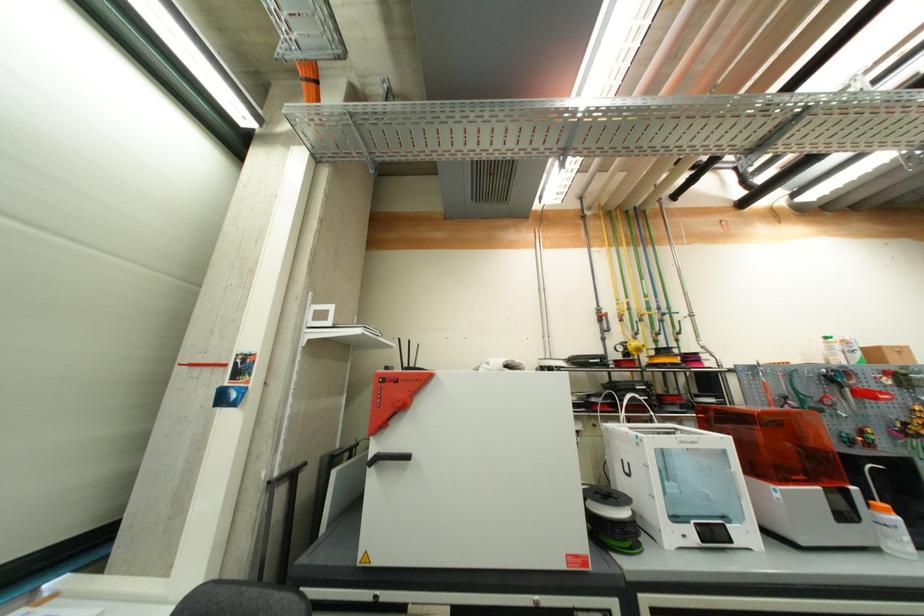
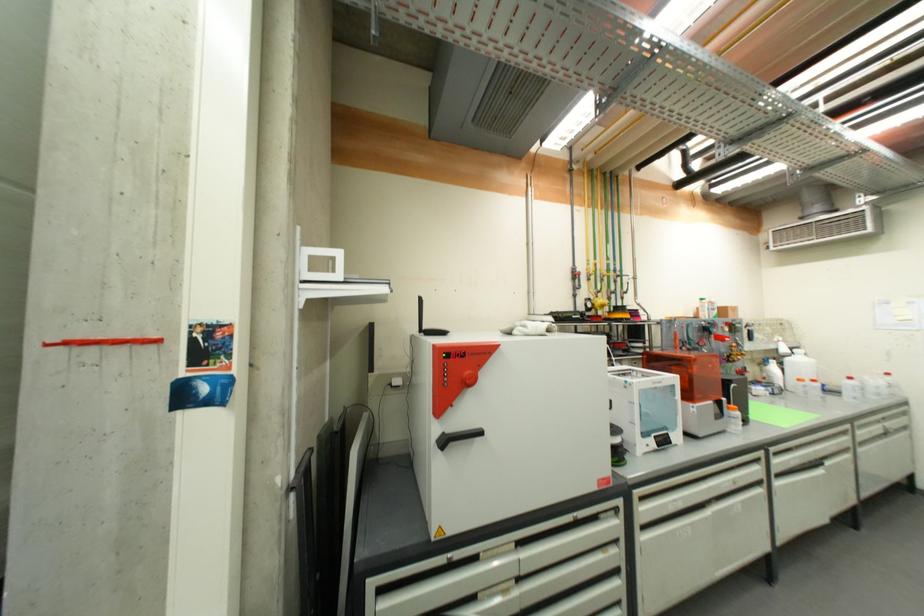
Find the pixel in the second image that matches point (383, 455) in the first image.

(448, 435)